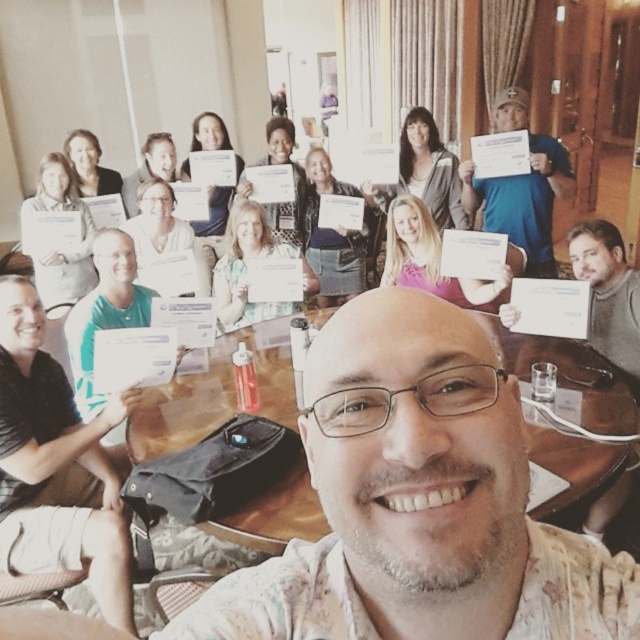
Question: Among these points, which one is nearest to the camera?

Choices:
 (A) (136, 291)
 (B) (518, 209)
 (C) (8, 292)
 (D) (205, 396)

Answer: (C)

Question: Does black shirt at lower left appear under blue fabric shirt at upper right?

Choices:
 (A) no
 (B) yes

Answer: (B)

Question: Can you confirm if blue fabric shirt at upper right is positioned above green matte shirt at center?

Choices:
 (A) no
 (B) yes

Answer: (B)

Question: Considering the real-world distances, which object is farthest from the blue fabric shirt at upper right?

Choices:
 (A) black shirt at lower left
 (B) wooden table at center

Answer: (A)

Question: Which point is closer to the camera taking this photo?

Choices:
 (A) (216, 380)
 (B) (83, 467)

Answer: (B)

Question: Can you confirm if wooden table at center is positioned above blue fabric shirt at upper right?

Choices:
 (A) no
 (B) yes

Answer: (A)